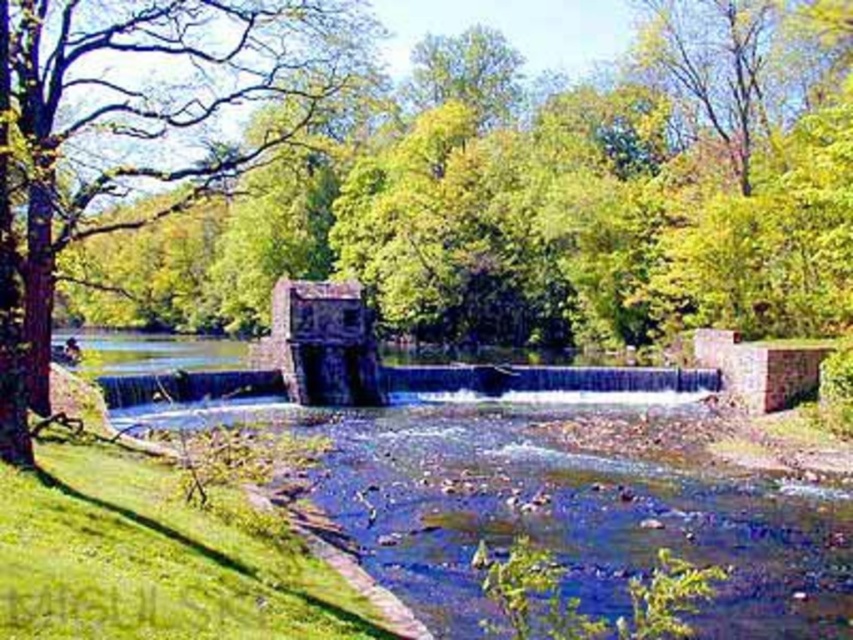
Question: Which point appears closest to the camera in this image?

Choices:
 (A) (196, 196)
 (B) (683, 144)

Answer: (A)

Question: Which point appears closest to the camera in this image?

Choices:
 (A) (4, 19)
 (B) (599, 310)

Answer: (A)

Question: Is green leafy tree at center thinner than green leafy tree at left?

Choices:
 (A) no
 (B) yes

Answer: (A)

Question: In this image, where is green leafy tree at center located relative to green leafy tree at left?

Choices:
 (A) below
 (B) above

Answer: (A)

Question: Can you confirm if green leafy tree at center is smaller than green leafy tree at left?

Choices:
 (A) no
 (B) yes

Answer: (A)